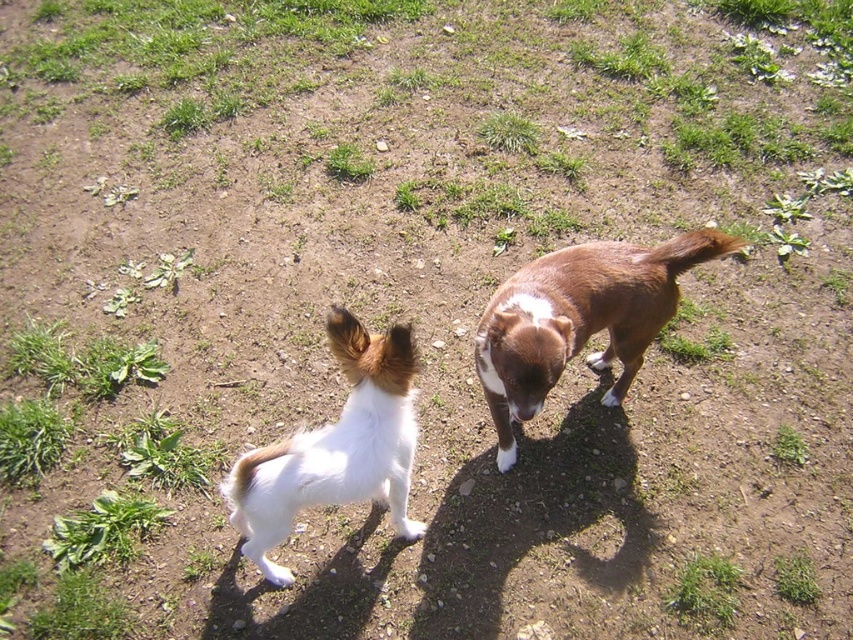
Question: Can you confirm if brown furry tail at upper right is thinner than green soft grass at center?

Choices:
 (A) yes
 (B) no

Answer: (A)

Question: Which point appears closest to the camera in this image?

Choices:
 (A) (262, 460)
 (B) (708, 580)
 (C) (556, 253)

Answer: (A)

Question: Which object appears farthest from the camera in this image?

Choices:
 (A) white fluffy tail at lower center
 (B) green leafy grass at lower right
 (C) green grass at lower right

Answer: (B)

Question: Which point appears farthest from the camera in this image?

Choices:
 (A) (566, 340)
 (B) (252, 472)
 (C) (730, 602)

Answer: (C)

Question: Is green leafy grass at lower left bigger than green grass at lower right?

Choices:
 (A) no
 (B) yes

Answer: (B)

Question: Does green leafy grass at lower left appear over green soft grass at center?

Choices:
 (A) yes
 (B) no

Answer: (B)